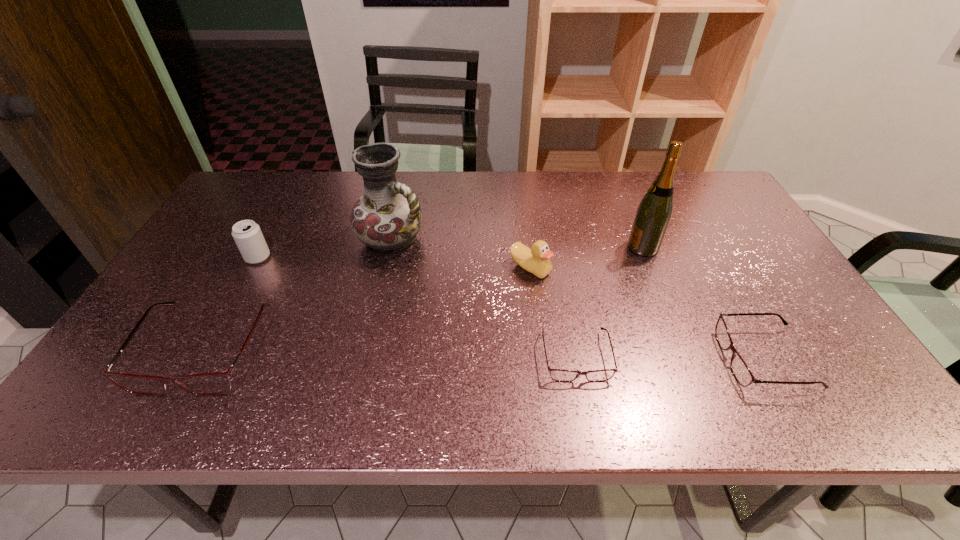
Where is `spectacles that is positioned at the left edge`? Image resolution: width=960 pixels, height=540 pixels. spectacles that is positioned at the left edge is located at coordinates (207, 384).

What are the coordinates of `can present at the left edge` in the screenshot? It's located at (247, 235).

The image size is (960, 540). What are the coordinates of `object located in the right edge section of the desktop` in the screenshot? It's located at (740, 370).

Identify the location of object present at the near left corner. (207, 384).

The height and width of the screenshot is (540, 960). In order to click on object present at the near right corner in this screenshot , I will do `click(740, 370)`.

In the image, there is a desktop. Identify the location of vacant space at the far edge. (320, 186).

In the image, there is a desktop. Where is `free space at the near edge`? free space at the near edge is located at coordinates (476, 349).

In the image, there is a desktop. Where is `free space at the right edge`? The width and height of the screenshot is (960, 540). free space at the right edge is located at coordinates (733, 248).

You are a GUI agent. You are given a task and a screenshot of the screen. Output one action in this format:
    pyautogui.click(x=<x>, y=<y>)
    Task: Click on the free space at the far left corner of the desktop
    
    Given the screenshot: What is the action you would take?
    pyautogui.click(x=272, y=178)

Where is `free spot between the second tallest spectacles and the duck`? The image size is (960, 540). free spot between the second tallest spectacles and the duck is located at coordinates [x=647, y=314].